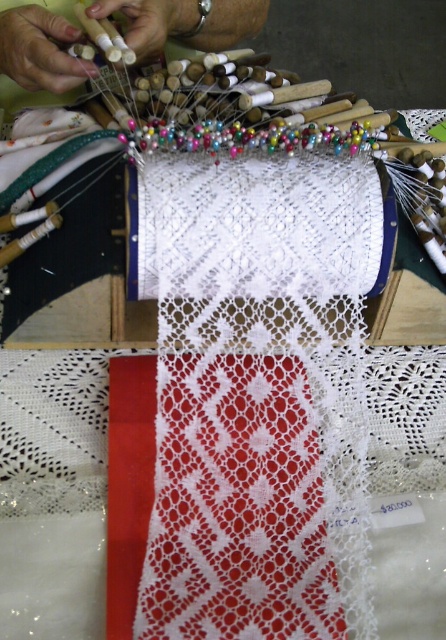
Where is the matte white hand at upper left located in the image?

The matte white hand at upper left is located at point (41, 51) in the image.

You are an apprentice learning lace making and need to position your hand and the wooden sticks properly. According to the scene, which object is higher in the image between the matte white hand at upper left and the white matte wooden sticks at upper center?

The matte white hand at upper left is taller than the white matte wooden sticks at upper center in the image.

You are a craftsperson working on the lace. You need to move your hand to the position of the lace frame. Which direction should you move your hand from the current position at point (41, 51)?

The hand is currently at point (41, 51), which is the upper left corner. To reach the lace frame in the center, the hand should move towards the lower right direction.